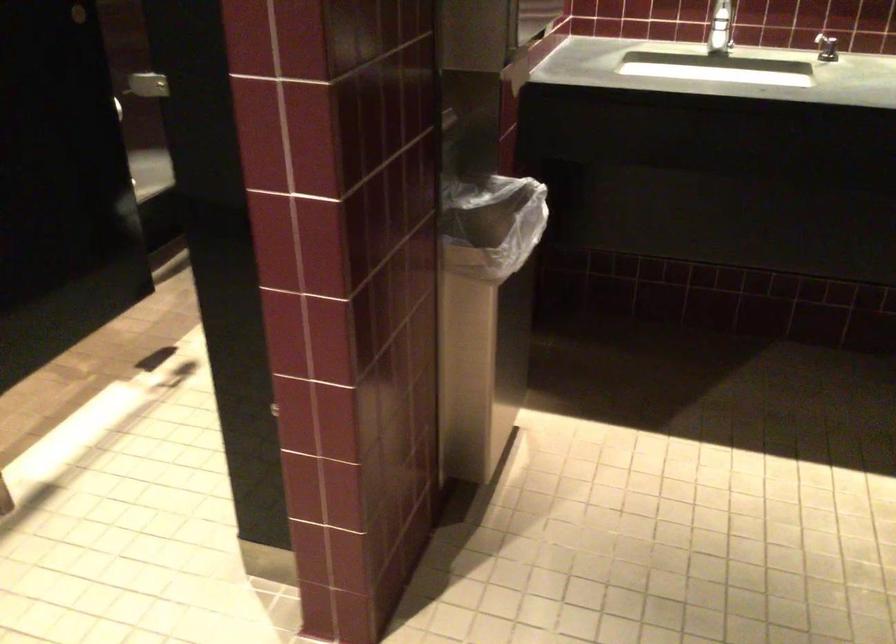
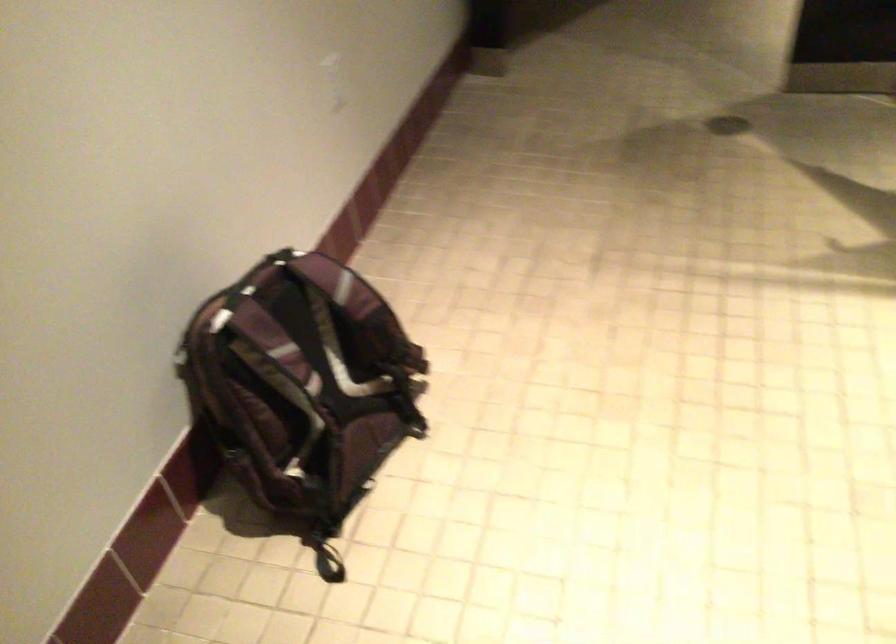
First-person continuous shooting, in which direction is the camera rotating?

The camera rotated toward left-down.